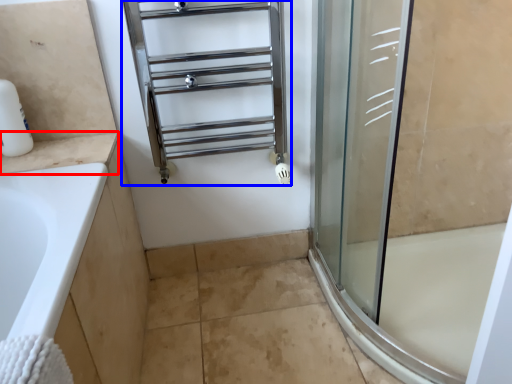
Question: Which of the following is the farthest to the observer, counter top (highlighted by a red box) or shelf (highlighted by a blue box)?

Choices:
 (A) counter top
 (B) shelf

Answer: (A)